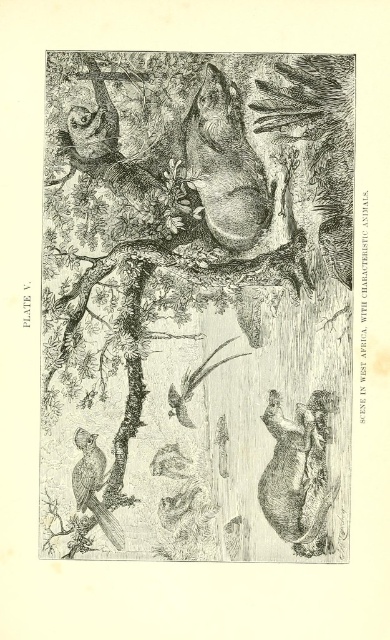
Locate an element on the screen. Image resolution: width=390 pixels, height=640 pixels. black ink drawing of tree at center is located at coordinates (198, 301).

Is black ink drawing of tree at center above brown fur bear at center?

Yes, black ink drawing of tree at center is above brown fur bear at center.

Locate an element on the screen. black ink drawing of tree at center is located at coordinates (198, 301).

Based on the photo, between black ink drawing of tree at center and brown textured bird at lower left, which one has less height?

brown textured bird at lower left is shorter.

Does black ink drawing of tree at center have a larger size compared to brown textured bird at lower left?

Yes, black ink drawing of tree at center is bigger than brown textured bird at lower left.

Where is `black ink drawing of tree at center`? The height and width of the screenshot is (640, 390). black ink drawing of tree at center is located at coordinates (198, 301).

Identify the location of black ink drawing of tree at center. (198, 301).

What do you see at coordinates (299, 472) in the screenshot? This screenshot has width=390, height=640. I see `brown fur bear at center` at bounding box center [299, 472].

Consider the image. Measure the distance between point (283, 461) and camera.

Point (283, 461) is 1.30 meters from camera.

Between point (310, 448) and point (120, 548), which one is positioned in front?

Positioned in front is point (120, 548).

The width and height of the screenshot is (390, 640). I want to click on brown fur bear at center, so click(299, 472).